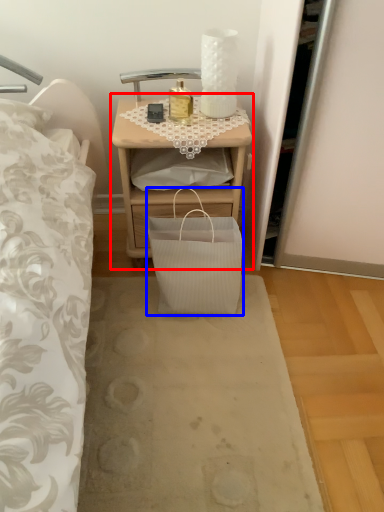
Question: Which of the following is the farthest to the observer, nightstand (highlighted by a red box) or bag (highlighted by a blue box)?

Choices:
 (A) nightstand
 (B) bag

Answer: (A)